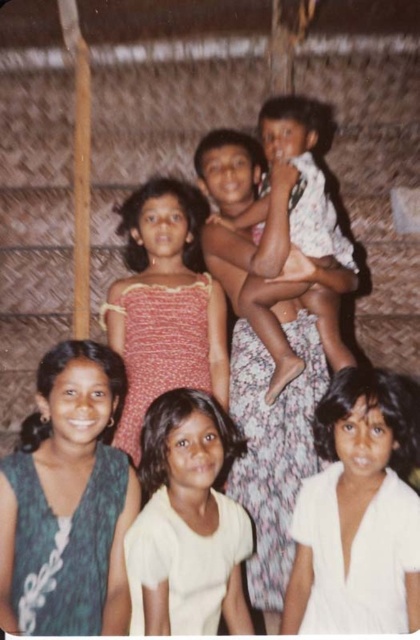
Question: From the image, what is the correct spatial relationship of green textured dress at lower left in relation to matte pink dress at center?

Choices:
 (A) left
 (B) right

Answer: (A)

Question: Which point appears farthest from the camera in this image?

Choices:
 (A) (212, 449)
 (B) (97, 554)
 (C) (294, 428)
 (D) (181, 320)

Answer: (D)

Question: Which of the following is the closest to the observer?

Choices:
 (A) (165, 332)
 (B) (196, 566)
 (C) (4, 564)

Answer: (C)

Question: Which point is closer to the camera?

Choices:
 (A) (372, 397)
 (B) (52, 467)
 (C) (312, 193)

Answer: (A)

Question: Does green textured dress at lower left come behind floral fabric dress at center?

Choices:
 (A) no
 (B) yes

Answer: (A)

Question: Does white matte dress at lower right appear on the right side of matte pink dress at center?

Choices:
 (A) no
 (B) yes

Answer: (B)